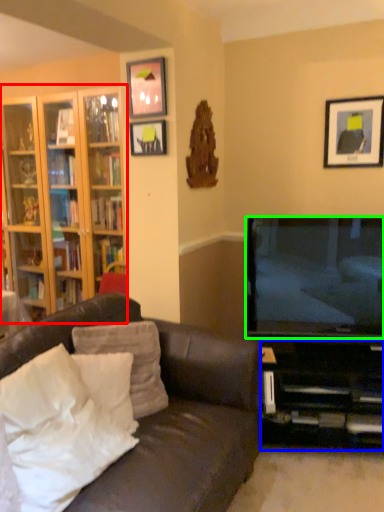
Question: Which object is the closest to the cabinetry (highlighted by a red box)? Choose among these: entertainment center (highlighted by a blue box) or television (highlighted by a green box).

Choices:
 (A) entertainment center
 (B) television

Answer: (B)